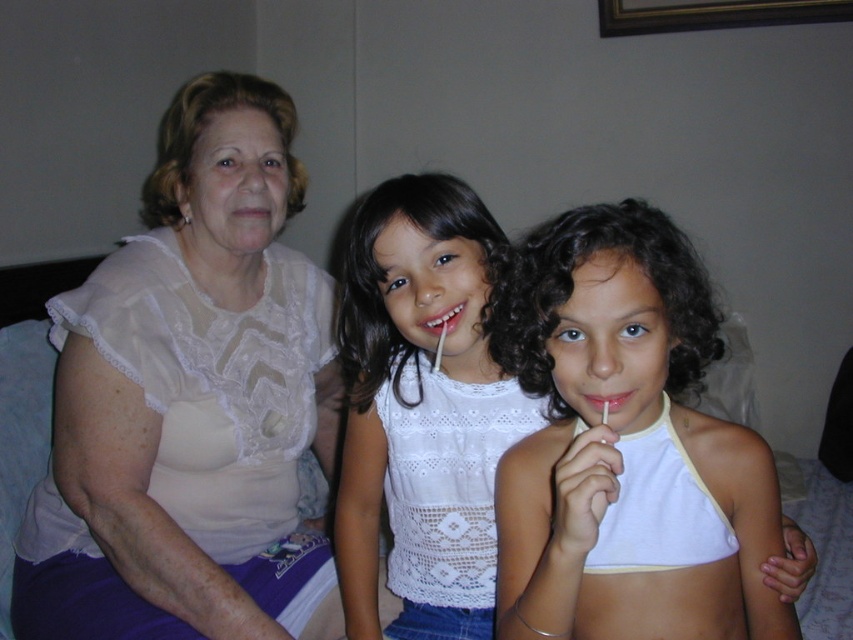
Is point (424, 362) closer to camera compared to point (433, 298)?

That is False.

Find the location of a particular element. Image resolution: width=853 pixels, height=640 pixels. white lace shirt at center is located at coordinates 422,410.

This screenshot has height=640, width=853. I want to click on white lace shirt at center, so click(x=422, y=410).

Is point (556, 385) less distant than point (426, 321)?

Yes.

Who is more distant from viewer, (703, 317) or (442, 316)?

Point (442, 316)

Where is `white cotton halter top at center`? The width and height of the screenshot is (853, 640). white cotton halter top at center is located at coordinates (621, 436).

Is white cotton halter top at center above matte pink lips at center?

No.

Is point (637, 404) more distant than point (595, 392)?

Yes.

Is point (642, 234) positioned before point (596, 401)?

No, (642, 234) is behind (596, 401).

Locate an element on the screen. The width and height of the screenshot is (853, 640). white cotton halter top at center is located at coordinates (621, 436).